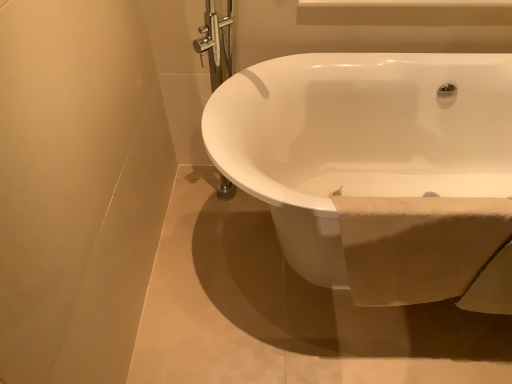
Question: Considering the positions of white glossy bathtub at center and white soft towel at lower right in the image, is white glossy bathtub at center taller or shorter than white soft towel at lower right?

Choices:
 (A) short
 (B) tall

Answer: (B)

Question: Is white glossy bathtub at center situated inside white soft towel at lower right or outside?

Choices:
 (A) inside
 (B) outside

Answer: (B)

Question: Looking at the image, does white glossy bathtub at center seem bigger or smaller compared to white soft towel at lower right?

Choices:
 (A) small
 (B) big

Answer: (B)

Question: Is white soft towel at lower right taller or shorter than white glossy bathtub at center?

Choices:
 (A) short
 (B) tall

Answer: (A)

Question: Considering their positions, is white soft towel at lower right located in front of or behind white glossy bathtub at center?

Choices:
 (A) behind
 (B) front

Answer: (A)

Question: Is white soft towel at lower right wider or thinner than white glossy bathtub at center?

Choices:
 (A) wide
 (B) thin

Answer: (B)

Question: Is point (385, 302) closer or farther from the camera than point (231, 110)?

Choices:
 (A) closer
 (B) farther

Answer: (A)